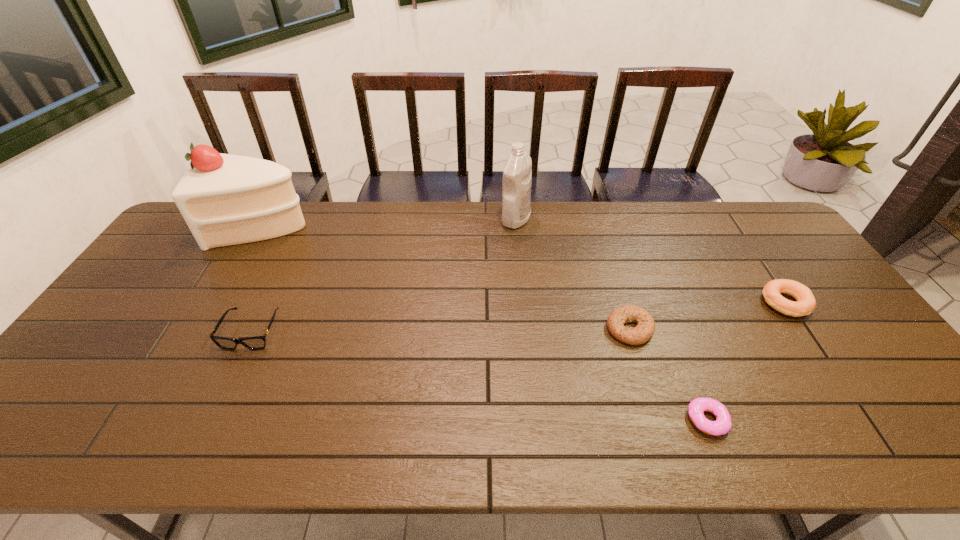
Image resolution: width=960 pixels, height=540 pixels. I want to click on free space between the cake and the fifth tallest object, so click(446, 278).

Where is `vacant area between the fifth tallest object and the rightmost object`? This screenshot has width=960, height=540. vacant area between the fifth tallest object and the rightmost object is located at coordinates point(708,316).

Find the location of a particular element. This screenshot has height=540, width=960. vacant point located between the right bagel and the sunglasses is located at coordinates (518, 318).

Identify which object is located as the nearest to the shortest object. Please provide its 2D coordinates. Your answer should be formatted as a tuple, i.e. [(x, y)], where the tuple contains the x and y coordinates of a point satisfying the conditions above.

[(645, 328)]

Where is `object identified as the second closest to the sunglasses`? The width and height of the screenshot is (960, 540). object identified as the second closest to the sunglasses is located at coordinates (517, 173).

Locate an element on the screen. This screenshot has height=540, width=960. vacant area in the image that satisfies the following two spatial constraints: 1. on the front side of the cake; 2. on the right side of the fifth object from left to right is located at coordinates (152, 420).